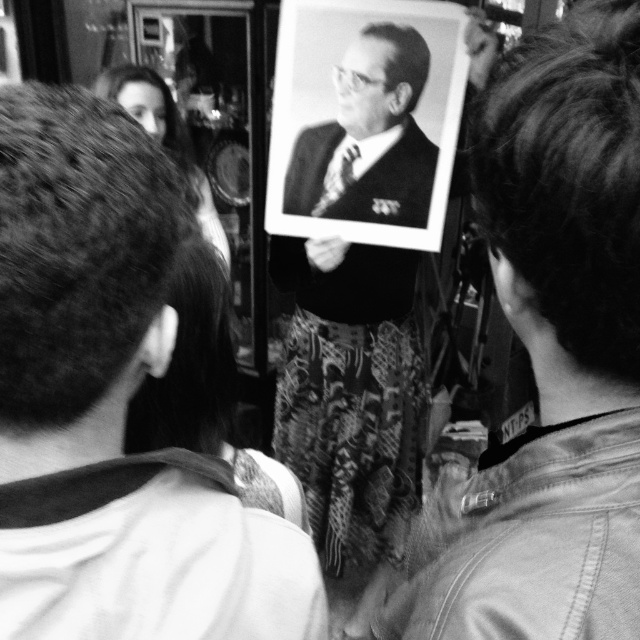
Is black textured suit at center positioned at the back of smooth skin face at upper left?

That is False.

Who is more forward, (380, 120) or (218, 250)?

Point (218, 250)

Where is `black textured suit at center`? The height and width of the screenshot is (640, 640). black textured suit at center is located at coordinates (349, 394).

Who is positioned more to the right, smooth suit at center or black textured suit at center?

Positioned to the right is smooth suit at center.

Which is behind, point (580, 557) or point (387, 28)?

Point (387, 28)

Which is in front, point (538, 140) or point (342, 480)?

Point (538, 140) is more forward.

This screenshot has height=640, width=640. In order to click on smooth suit at center in this screenshot , I will do `click(548, 356)`.

Which is below, smooth suit at center or smooth skin face at upper left?

Positioned lower is smooth suit at center.

In the scene shown: Can you confirm if smooth suit at center is positioned to the right of smooth skin face at upper left?

Correct, you'll find smooth suit at center to the right of smooth skin face at upper left.

The image size is (640, 640). Find the location of `smooth suit at center`. smooth suit at center is located at coordinates (548, 356).